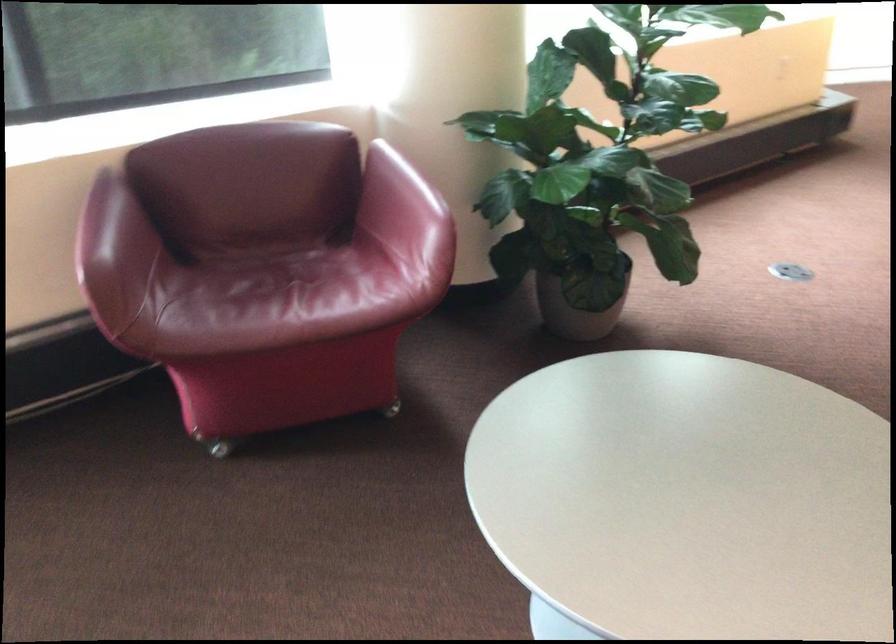
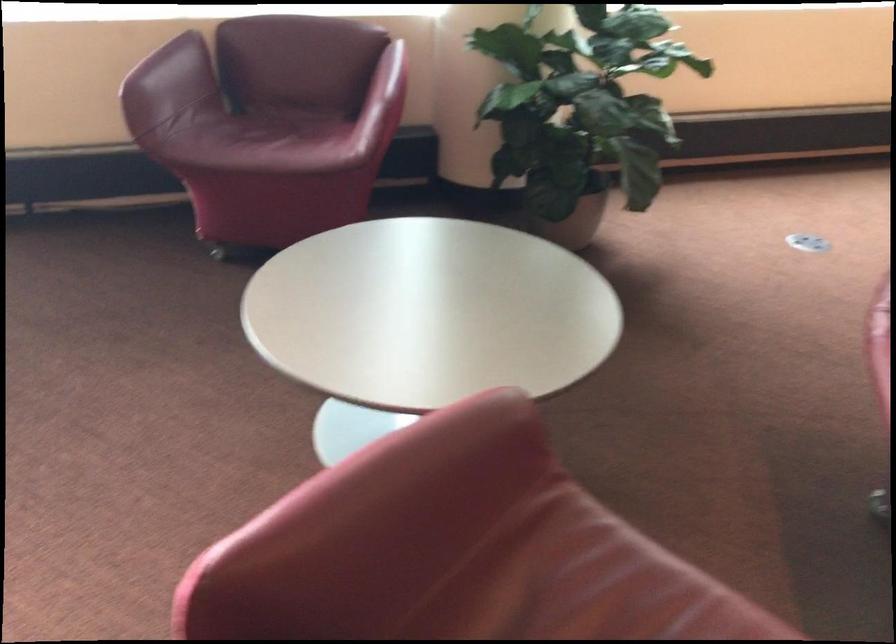
The point at (280, 301) is marked in the first image. Where is the corresponding point in the second image?

(263, 140)